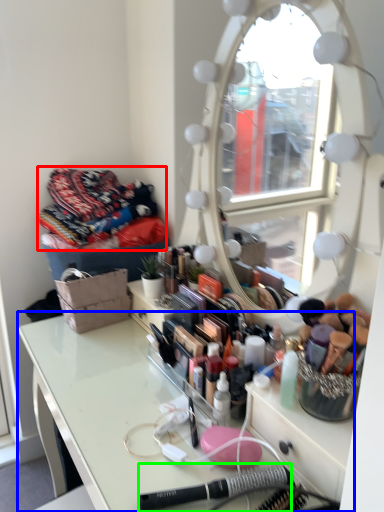
Question: Which object is positioned farthest from clothing (highlighted by a red box)? Select from table (highlighted by a blue box) and equipment (highlighted by a green box).

Choices:
 (A) table
 (B) equipment

Answer: (B)